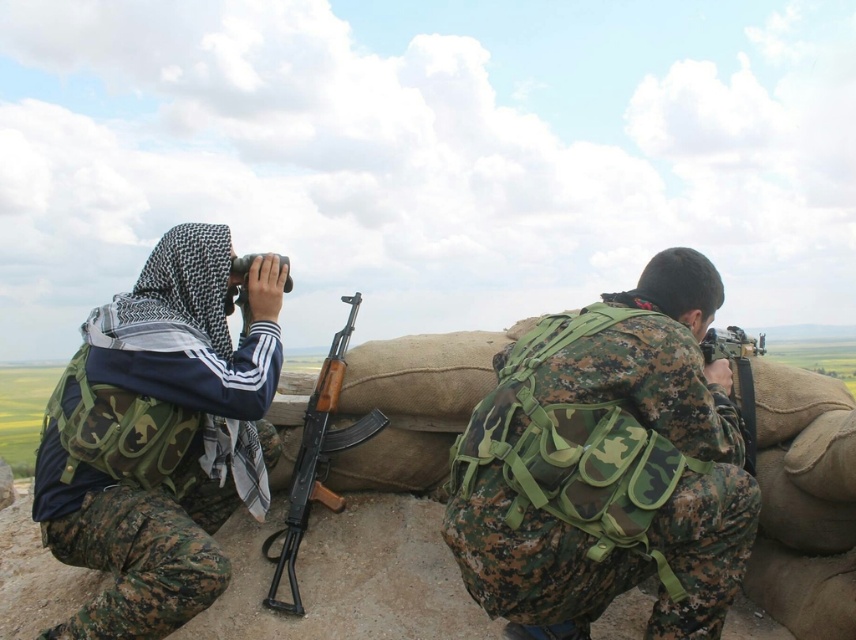
You are a military planner trying to decide where to place a new communication device. The device requires a stable surface at least 30 cm tall. You have two options in the image, the camo fabric backpack at center and the matte black binoculars at upper center. Which object can provide the required height?

The camo fabric backpack at center is much taller than the matte black binoculars at upper center, so it can provide the required height of at least 30 cm for the communication device.